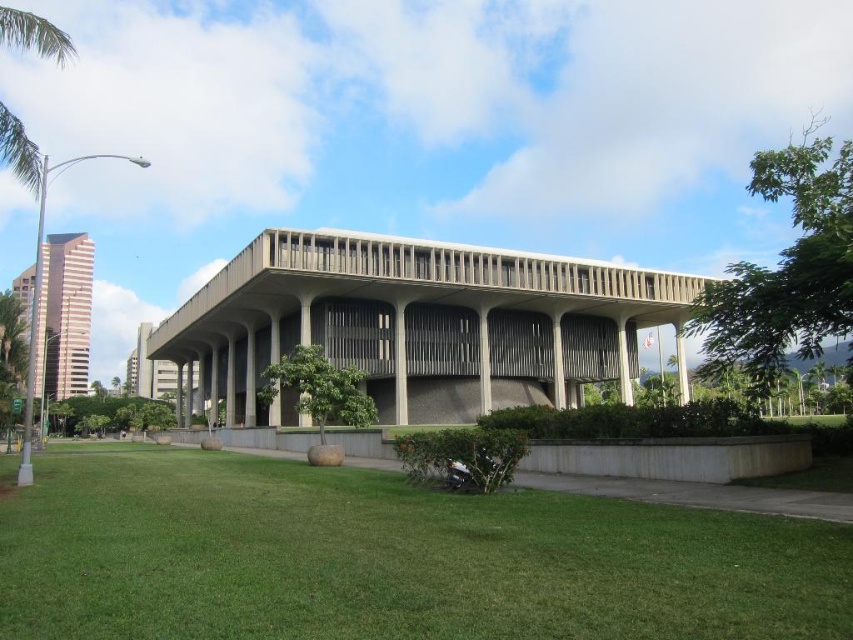
Can you confirm if green grass at center is positioned to the right of green leafy palm tree at upper left?

Correct, you'll find green grass at center to the right of green leafy palm tree at upper left.

The height and width of the screenshot is (640, 853). What are the coordinates of `green grass at center` in the screenshot? It's located at (390, 557).

You are a GUI agent. You are given a task and a screenshot of the screen. Output one action in this format:
    pyautogui.click(x=<x>, y=<y>)
    Task: Click on the green grass at center
    
    Given the screenshot: What is the action you would take?
    pyautogui.click(x=390, y=557)